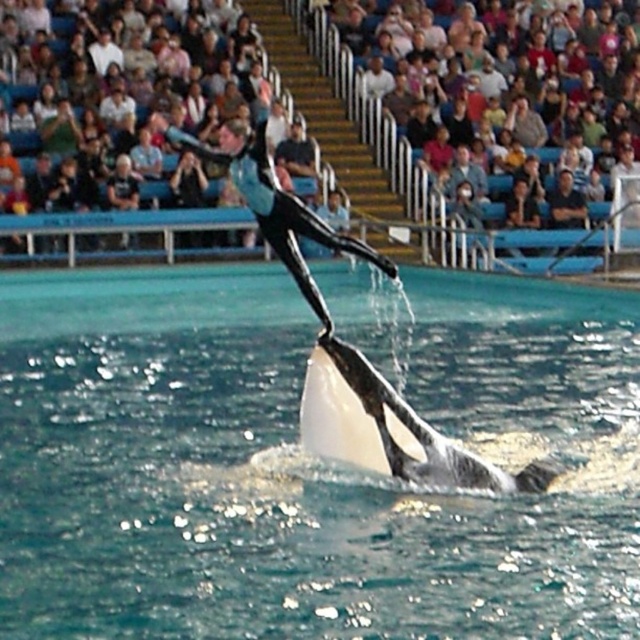
You are a photographer trying to capture the crowd at the marine show. You know that the multicolored fabric crowd at upper center is located at point (316, 112). If you want to focus your camera on this crowd, which direction should you point your camera relative to the orca and the person on its back?

The multicolored fabric crowd at upper center is located at point (316, 112), so you should point your camera towards the upper center direction relative to the orca and the person on its back.

You are a photographer positioned at the back of the bleachers. You want to take a photo of both the point at coordinates point (300, 92) and point (300, 428) in the scene. Which point is closer to your camera lens?

Point (300, 92) is closer to the camera lens because it is further to the viewer than point (300, 428).